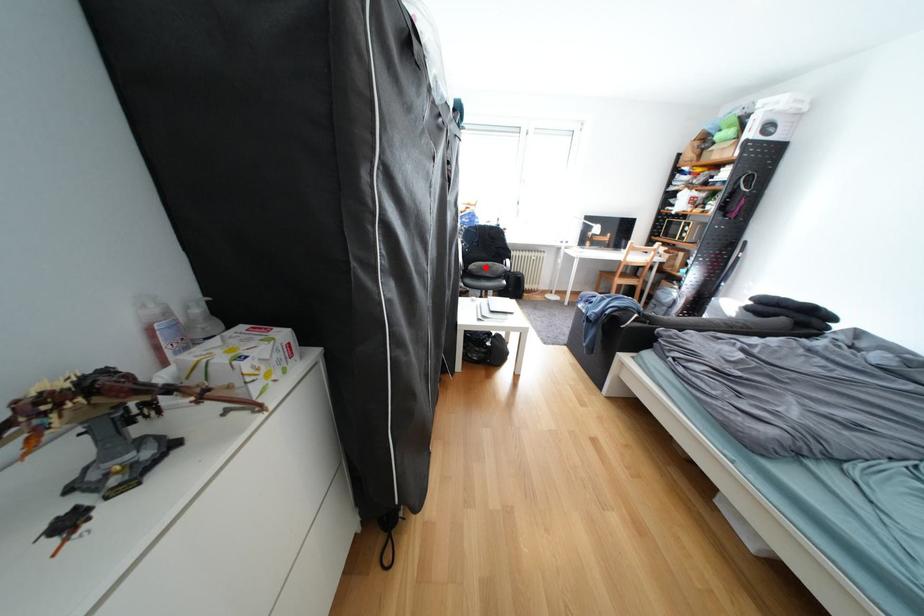
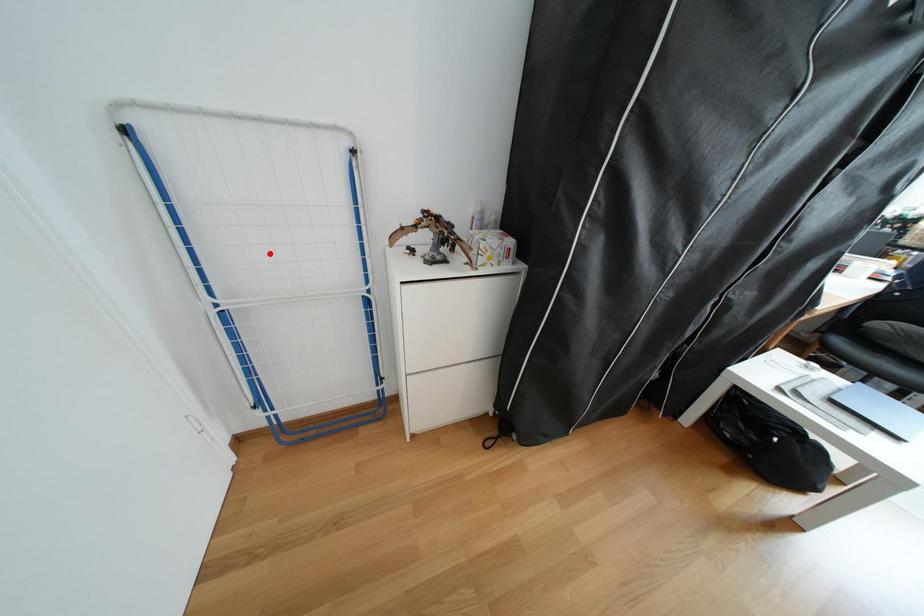
Consider the image. I am providing you with two images of the same scene from different viewpoints. A red point is marked on the first image and another point is marked on the second image. Are the points marked in image1 and image2 representing the same 3D position?

No